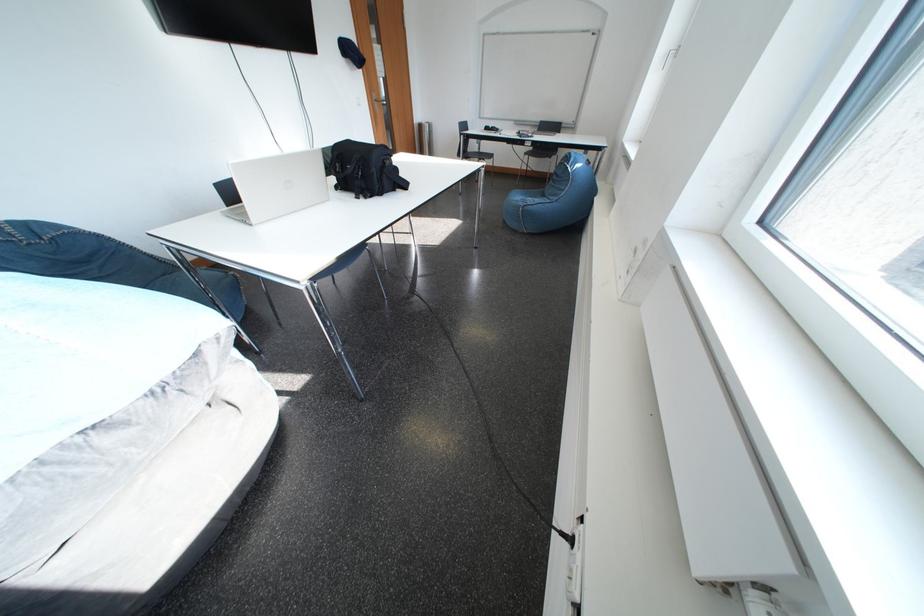
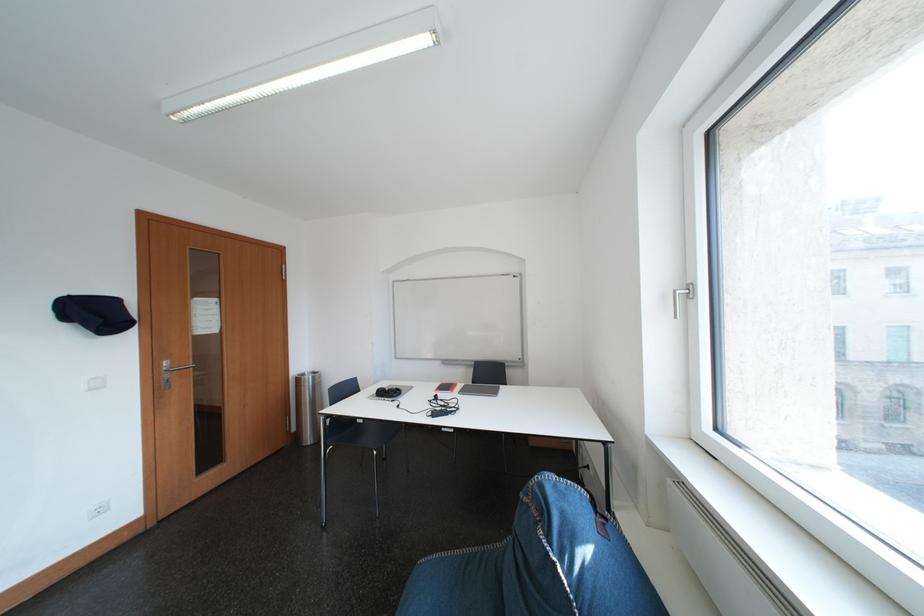
The point at (432, 129) is marked in the first image. Where is the corresponding point in the second image?

(310, 383)